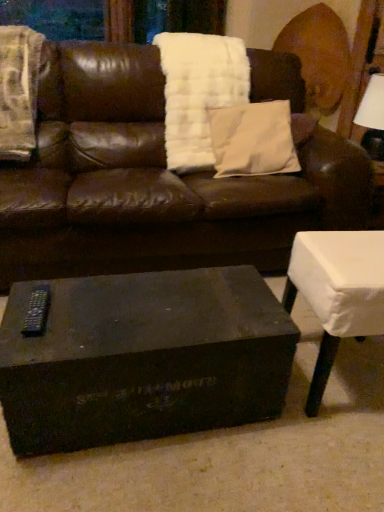
What are the coordinates of `free space above matte black coffee table at center (from a real-world perspective)` in the screenshot? It's located at (141, 309).